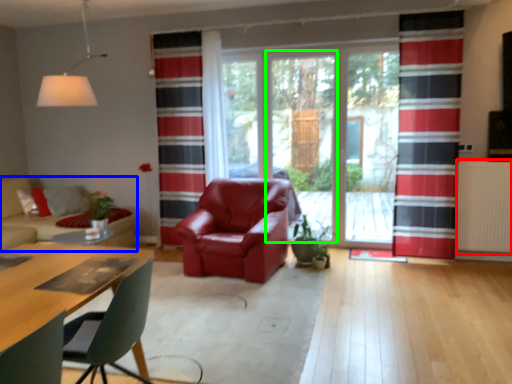
Question: Which object is positioned closest to radiator (highlighted by a red box)? Select from studio couch (highlighted by a blue box) and screen door (highlighted by a green box).

Choices:
 (A) studio couch
 (B) screen door

Answer: (B)